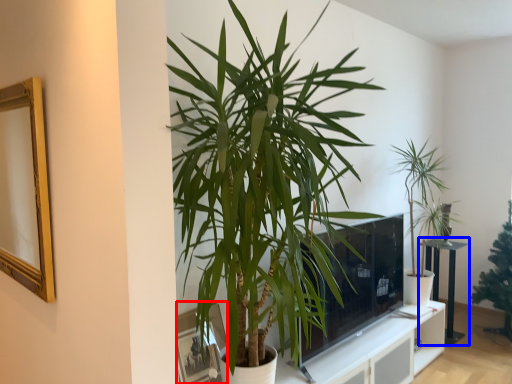
Question: Among these objects, which one is farthest to the camera, picture frame (highlighted by a red box) or table (highlighted by a blue box)?

Choices:
 (A) picture frame
 (B) table

Answer: (B)